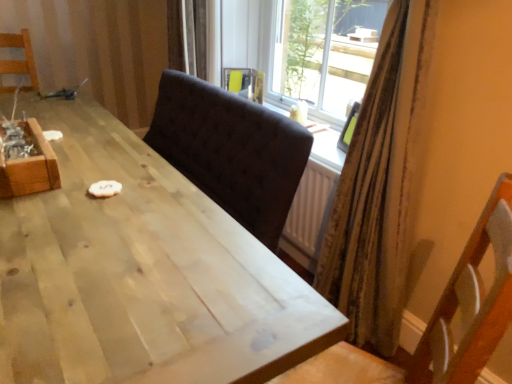
The image size is (512, 384). I want to click on wooden chair at left, positioned as the 1th chair in left-to-right order, so click(x=20, y=60).

Measure the distance between wooden chair at left, the 1th chair in the back-to-front sequence, and camera.

Result: A distance of 2.73 meters exists between wooden chair at left, the 1th chair in the back-to-front sequence, and camera.

The image size is (512, 384). Describe the element at coordinates (141, 274) in the screenshot. I see `light wood table at center` at that location.

You are a GUI agent. You are given a task and a screenshot of the screen. Output one action in this format:
    pyautogui.click(x=<x>, y=<y>)
    Task: Click on the wooden crate at left
    This screenshot has width=512, height=384.
    Given the screenshot: What is the action you would take?
    pyautogui.click(x=30, y=166)

I want to click on dark fabric chair at center, placed as the 2th chair when sorted from back to front, so pyautogui.click(x=438, y=320).

This screenshot has width=512, height=384. Find the location of `wooden chair at left, which ranks as the 1th chair in top-to-bottom order`. wooden chair at left, which ranks as the 1th chair in top-to-bottom order is located at coordinates (20, 60).

Considering the relative sizes of wooden crate at left and dark fabric chair at center, the first chair viewed from the front, in the image provided, is wooden crate at left bigger than dark fabric chair at center, the first chair viewed from the front,?

Actually, wooden crate at left might be smaller than dark fabric chair at center, the first chair viewed from the front.

Does wooden crate at left turn towards dark fabric chair at center, placed as the 2th chair when sorted from top to bottom?

No.

Which object is further away from the camera, wooden crate at left or dark fabric chair at center, the 2th chair when ordered from left to right?

Positioned behind is wooden crate at left.

Which is closer, (34, 166) or (347, 367)?

Point (347, 367)

Considering the sizes of objects wooden chair at left, which ranks as the 1th chair in top-to-bottom order, and light wood table at center in the image provided, who is wider, wooden chair at left, which ranks as the 1th chair in top-to-bottom order, or light wood table at center?

With larger width is light wood table at center.

Is wooden chair at left, positioned as the 1th chair in left-to-right order, placed right next to light wood table at center?

No, wooden chair at left, positioned as the 1th chair in left-to-right order, is not beside light wood table at center.

Considering the positions of objects wooden chair at left, positioned as the 1th chair in left-to-right order, and light wood table at center in the image provided, who is more to the left, wooden chair at left, positioned as the 1th chair in left-to-right order, or light wood table at center?

wooden chair at left, positioned as the 1th chair in left-to-right order.

The height and width of the screenshot is (384, 512). What are the coordinates of `table below the wooden chair at left, the 1th chair in the back-to-front sequence (from a real-world perspective)` in the screenshot? It's located at (141, 274).

Looking at this image, considering the relative sizes of wooden crate at left and wooden chair at left, which ranks as the 1th chair in top-to-bottom order, in the image provided, is wooden crate at left shorter than wooden chair at left, which ranks as the 1th chair in top-to-bottom order,?

Correct, wooden crate at left is not as tall as wooden chair at left, which ranks as the 1th chair in top-to-bottom order.

From a real-world perspective, is wooden crate at left below wooden chair at left, arranged as the second chair when viewed from the right?

Yes, from a real-world perspective, wooden crate at left is under wooden chair at left, arranged as the second chair when viewed from the right.

Who is smaller, wooden crate at left or wooden chair at left, arranged as the second chair when viewed from the right?

wooden crate at left.

Is wooden chair at left, arranged as the second chair when viewed from the right, surrounded by wooden crate at left?

Definitely not — wooden chair at left, arranged as the second chair when viewed from the right, is not inside wooden crate at left.

Is dark fabric chair at center, arranged as the 1th chair when viewed from the right, placed right next to wooden crate at left?

dark fabric chair at center, arranged as the 1th chair when viewed from the right, is not next to wooden crate at left, and they're not touching.

From a real-world perspective, is dark fabric chair at center, the 2th chair when ordered from left to right, physically located above or below wooden crate at left?

From a real-world perspective, dark fabric chair at center, the 2th chair when ordered from left to right, is physically below wooden crate at left.

Which object is closer to the camera taking this photo, dark fabric chair at center, the 2th chair when ordered from left to right, or wooden crate at left?

dark fabric chair at center, the 2th chair when ordered from left to right.

From the image's perspective, is dark fabric chair at center, arranged as the 1th chair when viewed from the right, located beneath wooden crate at left?

Indeed, from the image's perspective, dark fabric chair at center, arranged as the 1th chair when viewed from the right, is shown beneath wooden crate at left.

From a real-world perspective, is light wood table at center over wooden chair at left, marked as the 2th chair in a front-to-back arrangement?

No.

Consider the image. Considering the relative sizes of light wood table at center and wooden chair at left, positioned as the 1th chair in left-to-right order, in the image provided, is light wood table at center wider than wooden chair at left, positioned as the 1th chair in left-to-right order,?

Yes, light wood table at center is wider than wooden chair at left, positioned as the 1th chair in left-to-right order.

Between light wood table at center and wooden chair at left, which ranks as the 1th chair in top-to-bottom order, which one has smaller size?

Smaller between the two is wooden chair at left, which ranks as the 1th chair in top-to-bottom order.

Can you confirm if light wood table at center is taller than wooden chair at left, the second chair from the bottom?

Indeed, light wood table at center has a greater height compared to wooden chair at left, the second chair from the bottom.

Considering the sizes of objects wooden crate at left and light wood table at center in the image provided, who is bigger, wooden crate at left or light wood table at center?

light wood table at center.

The image size is (512, 384). What are the coordinates of `table on the right of wooden crate at left` in the screenshot? It's located at (141, 274).

How different are the orientations of wooden crate at left and light wood table at center in degrees?

Answer: They differ by 0.218 degrees in their facing directions.

In terms of height, does wooden crate at left look taller or shorter compared to light wood table at center?

wooden crate at left is shorter than light wood table at center.

This screenshot has height=384, width=512. In order to click on chair that is on the left side of dark fabric chair at center, placed as the 2th chair when sorted from top to bottom in this screenshot , I will do `click(20, 60)`.

Considering the positions of objects dark fabric chair at center, placed as the 2th chair when sorted from top to bottom, and wooden chair at left, arranged as the second chair when viewed from the right, in the image provided, who is more to the left, dark fabric chair at center, placed as the 2th chair when sorted from top to bottom, or wooden chair at left, arranged as the second chair when viewed from the right,?

wooden chair at left, arranged as the second chair when viewed from the right, is more to the left.

Considering the positions of points (341, 359) and (7, 72), is point (341, 359) farther from camera compared to point (7, 72)?

No, (341, 359) is in front of (7, 72).

Can we say dark fabric chair at center, arranged as the 1th chair when viewed from the right, lies outside wooden chair at left, marked as the 2th chair in a front-to-back arrangement?

Yes, dark fabric chair at center, arranged as the 1th chair when viewed from the right, is outside of wooden chair at left, marked as the 2th chair in a front-to-back arrangement.

Identify the location of crate above the dark fabric chair at center, the first chair viewed from the front (from the image's perspective). The image size is (512, 384). (30, 166).

Image resolution: width=512 pixels, height=384 pixels. I want to click on table that appears below the wooden chair at left, arranged as the second chair when viewed from the right (from the image's perspective), so click(x=141, y=274).

When comparing their distances from wooden chair at left, the second chair from the bottom, does dark fabric chair at center, the first chair viewed from the front, or wooden crate at left seem further?

dark fabric chair at center, the first chair viewed from the front, lies further to wooden chair at left, the second chair from the bottom, than the other object.

Which object lies nearer to the anchor point light wood table at center, wooden crate at left or dark fabric chair at center, placed as the 2th chair when sorted from back to front?

wooden crate at left is positioned closer to the anchor light wood table at center.

Based on their spatial positions, is wooden crate at left or light wood table at center further from wooden chair at left, which ranks as the 1th chair in top-to-bottom order?

light wood table at center is further to wooden chair at left, which ranks as the 1th chair in top-to-bottom order.

Estimate the real-world distances between objects in this image. Which object is closer to light wood table at center, wooden chair at left, arranged as the second chair when viewed from the right, or wooden crate at left?

wooden crate at left is positioned closer to the anchor light wood table at center.

Looking at the image, which one is located further to dark fabric chair at center, placed as the 2th chair when sorted from top to bottom, light wood table at center or wooden chair at left, marked as the 2th chair in a front-to-back arrangement?

Among the two, wooden chair at left, marked as the 2th chair in a front-to-back arrangement, is located further to dark fabric chair at center, placed as the 2th chair when sorted from top to bottom.

Considering their positions, is wooden chair at left, which ranks as the 1th chair in top-to-bottom order, positioned further to dark fabric chair at center, the 2th chair when ordered from left to right, than light wood table at center?

wooden chair at left, which ranks as the 1th chair in top-to-bottom order, is further to dark fabric chair at center, the 2th chair when ordered from left to right.

Which object lies further to the anchor point wooden crate at left, light wood table at center or wooden chair at left, arranged as the second chair when viewed from the right?

Among the two, wooden chair at left, arranged as the second chair when viewed from the right, is located further to wooden crate at left.

Which object lies further to the anchor point dark fabric chair at center, placed as the 2th chair when sorted from top to bottom, wooden crate at left or light wood table at center?

wooden crate at left is positioned further to the anchor dark fabric chair at center, placed as the 2th chair when sorted from top to bottom.

Find the location of a particular element. table situated between wooden crate at left and dark fabric chair at center, arranged as the 1th chair when viewed from the right, from left to right is located at coordinates [141, 274].

At what (x,y) coordinates should I click in order to perform the action: click on crate located between light wood table at center and wooden chair at left, marked as the 2th chair in a front-to-back arrangement, in the depth direction. Please return your answer as a coordinate pair (x, y). The image size is (512, 384). Looking at the image, I should click on (30, 166).

At what (x,y) coordinates should I click in order to perform the action: click on chair located between light wood table at center and wooden chair at left, positioned as the 1th chair in left-to-right order, in the depth direction. Please return your answer as a coordinate pair (x, y). The height and width of the screenshot is (384, 512). Looking at the image, I should click on (438, 320).

At what (x,y) coordinates should I click in order to perform the action: click on crate located between dark fabric chair at center, placed as the 2th chair when sorted from top to bottom, and wooden chair at left, arranged as the second chair when viewed from the right, in the depth direction. Please return your answer as a coordinate pair (x, y). This screenshot has width=512, height=384. Looking at the image, I should click on (30, 166).